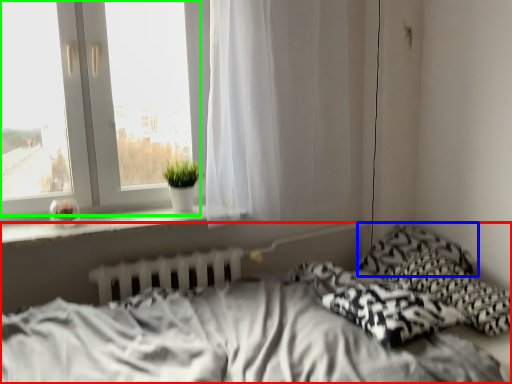
Question: Which object is the farthest from bed (highlighted by a red box)? Choose among these: pillow (highlighted by a blue box) or bay window (highlighted by a green box).

Choices:
 (A) pillow
 (B) bay window

Answer: (B)